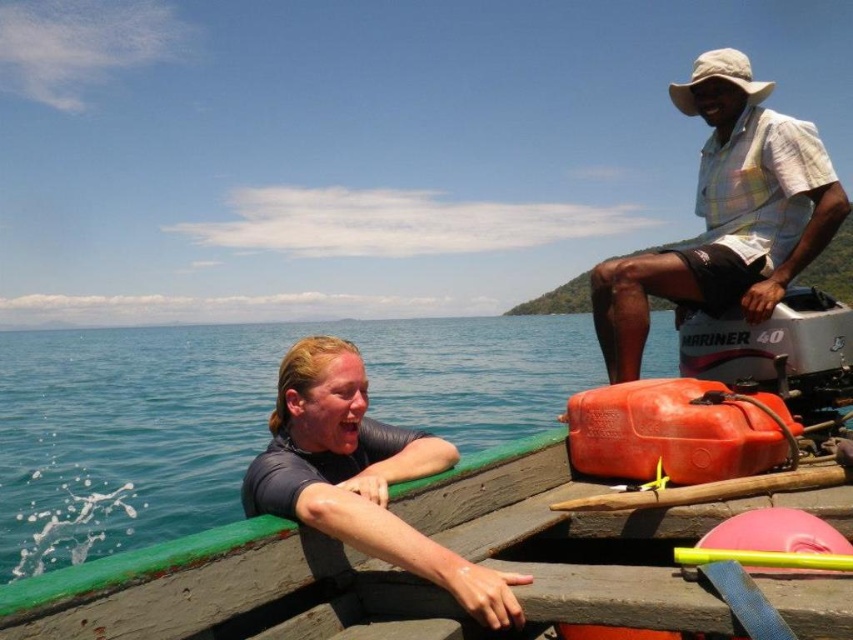
You are on a boat and need to hand a life jacket to someone. You see the white checkered shirt at upper right and the dark gray wetsuit at left. Which person is higher up and should you aim for to reach them first?

The white checkered shirt at upper right is above the dark gray wetsuit at left, so you should aim for the person wearing the white checkered shirt at upper right as they are higher up and easier to reach.

You are standing on the dock and looking at the green wood boat at center and the dark gray wetsuit at left. Which object is nearer to you?

The green wood boat at center is closer to the viewer than the dark gray wetsuit at left.

You are a photographer trying to capture both the white checkered shirt at upper right and the dark gray wetsuit at left in a single frame. Based on their positions, which object is positioned farther from the camera?

The white checkered shirt at upper right might be wider than the dark gray wetsuit at left, so it is likely positioned farther from the camera.